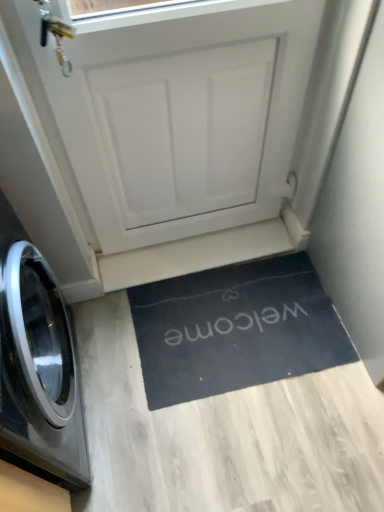
At what (x,y) coordinates should I click in order to perform the action: click on unoccupied region to the right of black glossy washing machine at left. Please return your answer as a coordinate pair (x, y). This screenshot has height=512, width=384. Looking at the image, I should click on (183, 441).